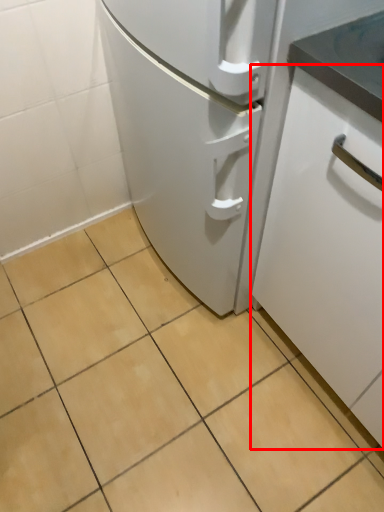
Question: Observing the image, what is the correct spatial positioning of cabinetry (annotated by the red box) in reference to ceramic tile?

Choices:
 (A) left
 (B) right

Answer: (B)